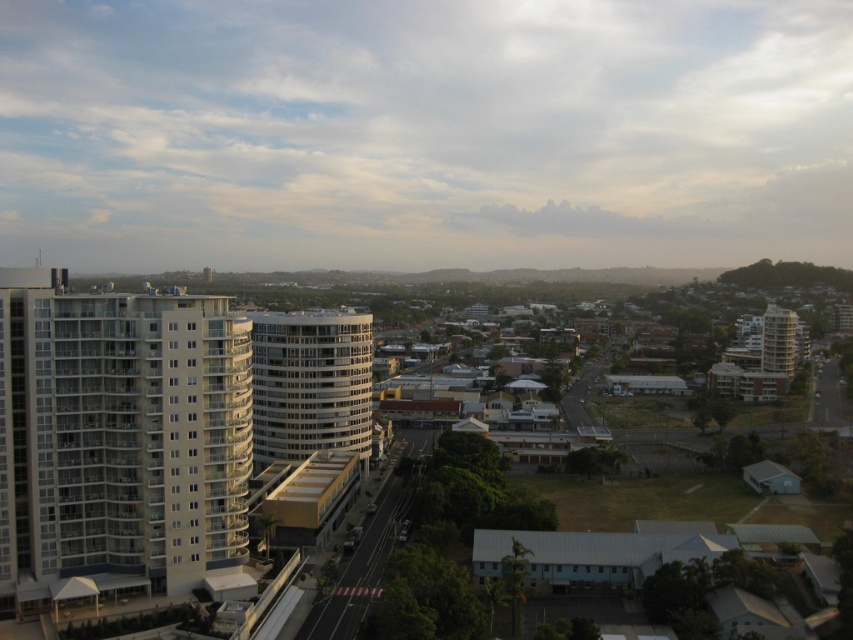
You are a city planner assessing the skyline. You need to determine which building, the white glossy building at left or the white glassy building at center, would cast a longer shadow at this time of day. Based on their heights, which one would cast a longer shadow?

The white glossy building at left is much taller than the white glassy building at center, so it would cast a longer shadow at this time of day.

You are standing in the city and see the white glossy building at left and the white glassy building at center. Which building is positioned lower in the image?

The white glossy building at left is located below the white glassy building at center, so it is positioned lower in the image.